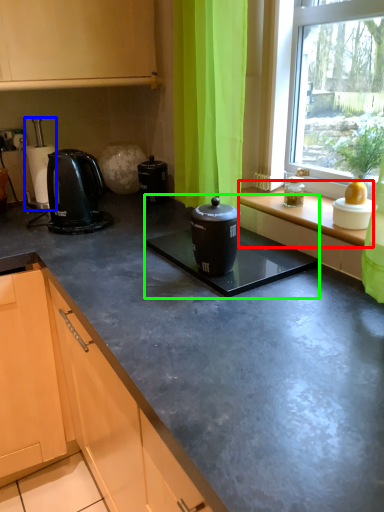
Question: Which object is positioned closest to window sill (highlighted by a red box)? Select from coffee machine (highlighted by a blue box) and sink (highlighted by a green box).

Choices:
 (A) coffee machine
 (B) sink

Answer: (B)